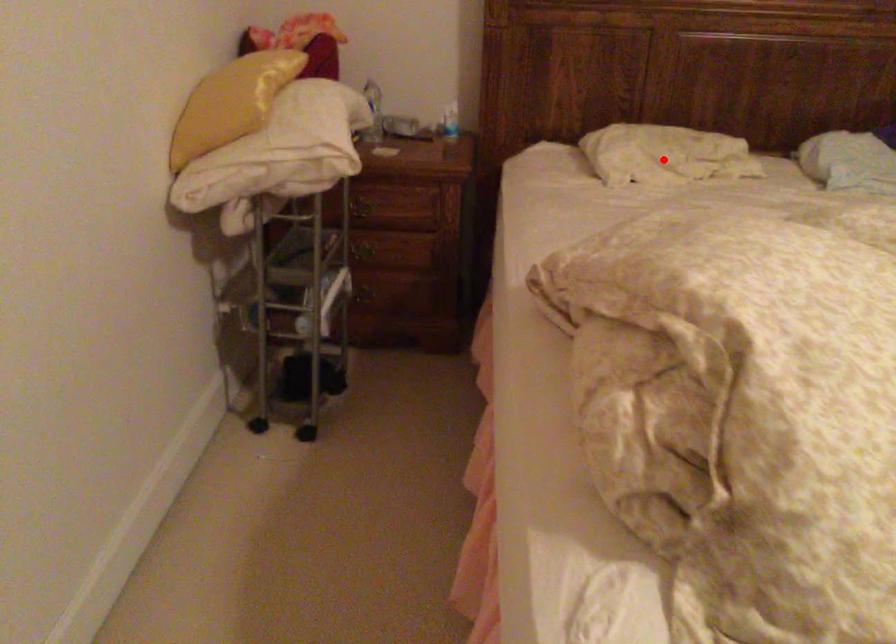
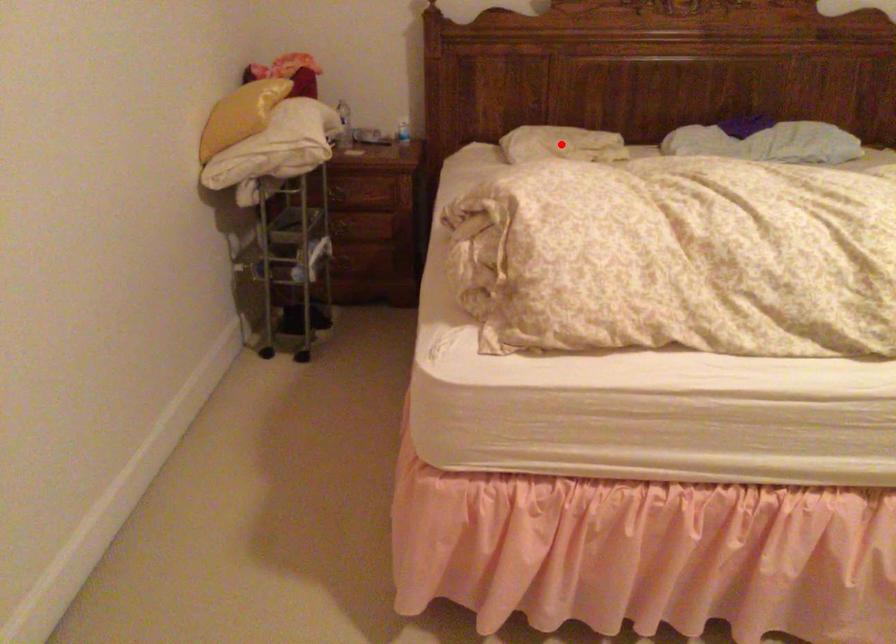
I am providing you with two images of the same scene from different viewpoints. A red point is marked on the first image and another point is marked on the second image. Are the points marked in image1 and image2 representing the same 3D position?

Yes